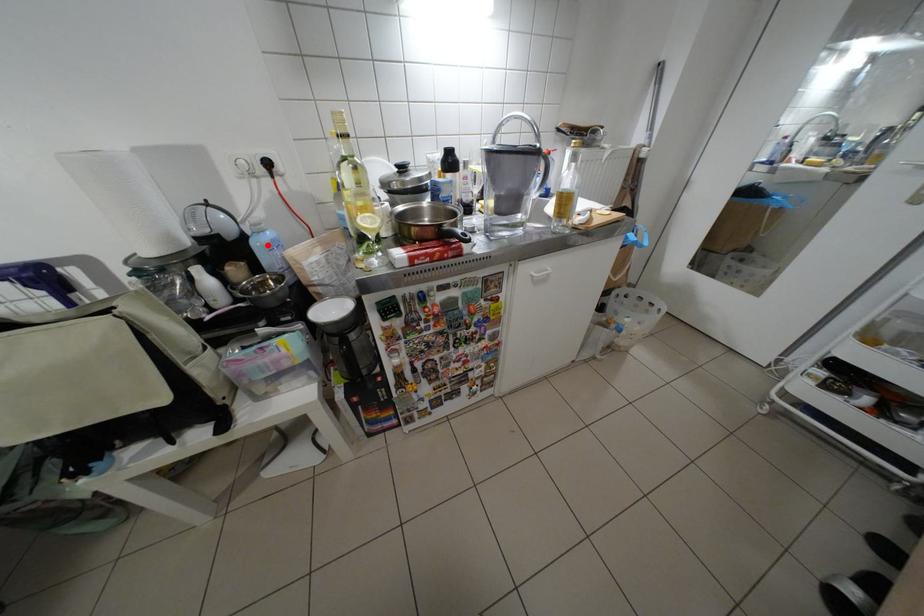
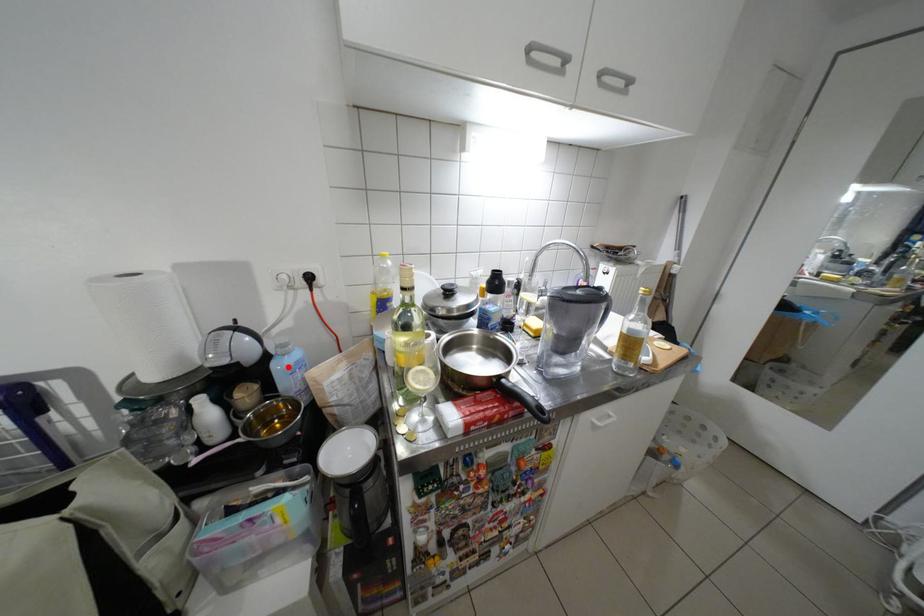
I am providing you with two images of the same scene from different viewpoints. A red point is marked on the first image and another point is marked on the second image. Do the highlighted points in image1 and image2 indicate the same real-world spot?

Yes